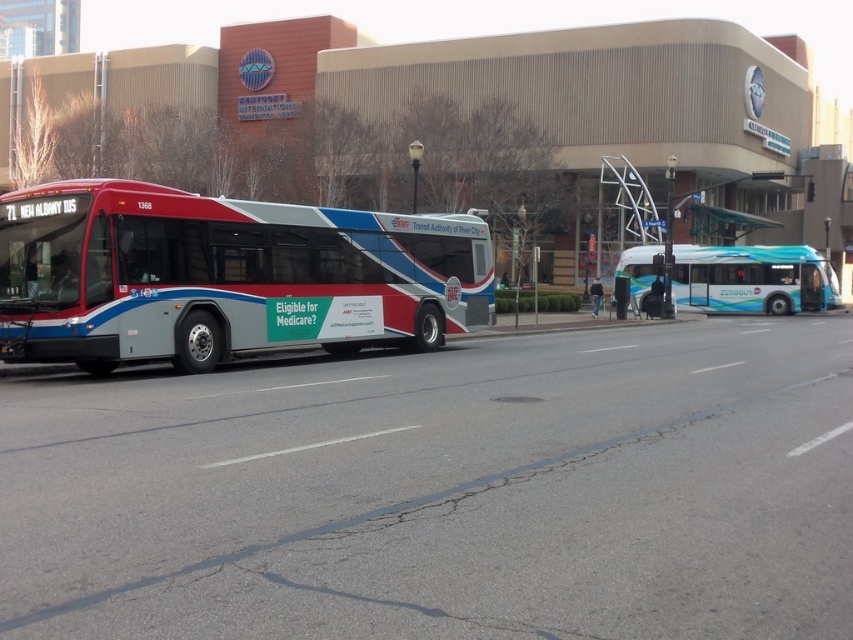
Question: Does matte metallic bus at center have a larger size compared to teal glossy bus at center?

Choices:
 (A) yes
 (B) no

Answer: (B)

Question: Is matte metallic bus at center to the left of teal glossy bus at center from the viewer's perspective?

Choices:
 (A) no
 (B) yes

Answer: (B)

Question: Observing the image, what is the correct spatial positioning of matte metallic bus at center in reference to teal glossy bus at center?

Choices:
 (A) left
 (B) right

Answer: (A)

Question: Which point is farther to the camera?

Choices:
 (A) (466, 224)
 (B) (809, 264)

Answer: (B)

Question: Which point appears closest to the camera in this image?

Choices:
 (A) (225, 227)
 (B) (689, 276)

Answer: (A)